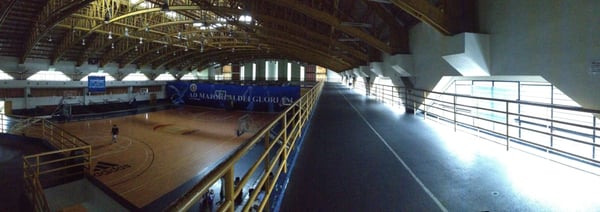
Where is `ceiling rafters, yellow`? Image resolution: width=600 pixels, height=212 pixels. ceiling rafters, yellow is located at coordinates (153, 30).